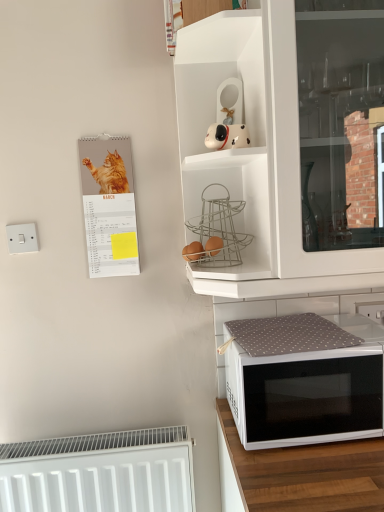
Question: Is white fabric-covered microwave at lower right inside or outside of white matte cabinet at upper center?

Choices:
 (A) outside
 (B) inside

Answer: (A)

Question: Considering their positions, is white fabric-covered microwave at lower right located in front of or behind white matte cabinet at upper center?

Choices:
 (A) behind
 (B) front

Answer: (B)

Question: Based on their relative distances, which object is nearer to the white matte cabinet at upper center?

Choices:
 (A) white matte dog figurine at upper center
 (B) matte paper calendar at left
 (C) brown matte eggs at center, the 1th food from the right
 (D) brown matte eggs at upper center, which appears as the 1th food when viewed from the left
 (E) white matte radiator at lower left

Answer: (A)

Question: Estimate the real-world distances between objects in this image. Which object is closer to the white matte radiator at lower left?

Choices:
 (A) brown matte eggs at upper center, the 2th food positioned from the right
 (B) white plastic electric outlet at upper right
 (C) white fabric-covered microwave at lower right
 (D) white matte cabinet at upper center
 (E) matte paper calendar at left

Answer: (C)